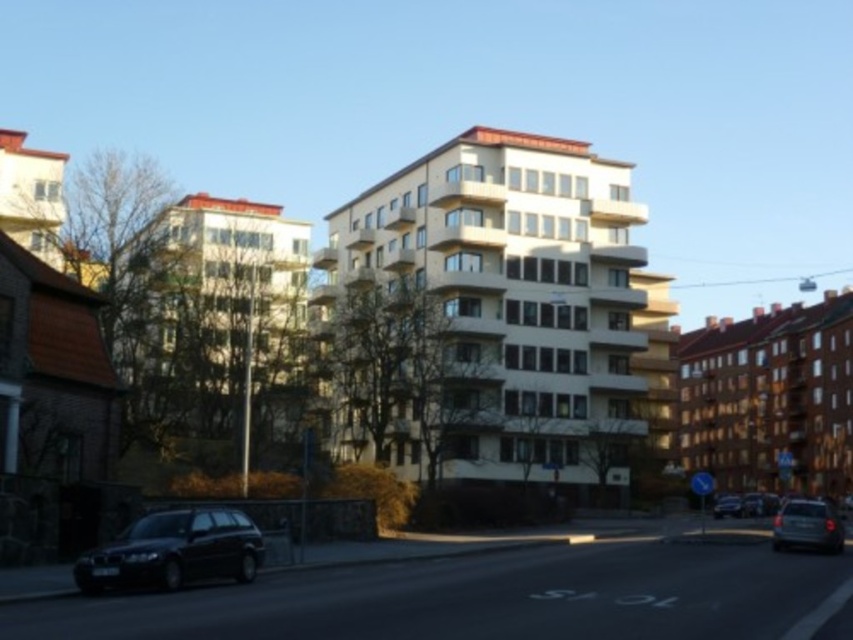
Question: Estimate the real-world distances between objects in this image. Which object is closer to the metallic silver suv at lower right?

Choices:
 (A) shiny black car at lower left
 (B) metallic silver car at center

Answer: (A)

Question: Is metallic silver suv at lower right wider than metallic silver car at center?

Choices:
 (A) no
 (B) yes

Answer: (A)

Question: Which object is closer to the camera taking this photo?

Choices:
 (A) metallic silver suv at lower right
 (B) shiny black car at lower left

Answer: (B)

Question: Among these objects, which one is nearest to the camera?

Choices:
 (A) shiny black car at lower left
 (B) metallic silver car at center

Answer: (A)

Question: Is metallic silver suv at lower right thinner than metallic silver car at center?

Choices:
 (A) no
 (B) yes

Answer: (B)

Question: Does metallic silver suv at lower right have a smaller size compared to metallic silver car at center?

Choices:
 (A) yes
 (B) no

Answer: (A)